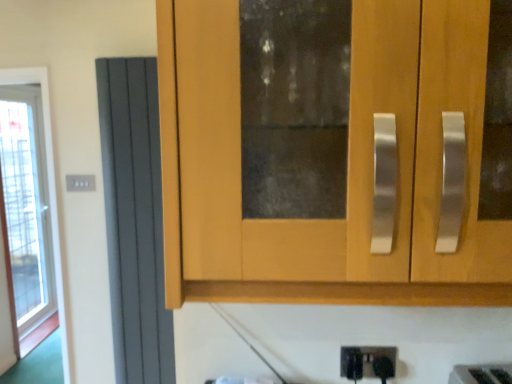
I want to click on white plastic electric outlet at upper left, so click(x=80, y=183).

The image size is (512, 384). Describe the element at coordinates (80, 183) in the screenshot. I see `white plastic electric outlet at upper left` at that location.

Describe the element at coordinates (134, 219) in the screenshot. I see `matte gray radiator at left` at that location.

Locate an element on the screen. matte gray radiator at left is located at coordinates (134, 219).

You are a GUI agent. You are given a task and a screenshot of the screen. Output one action in this format:
    pyautogui.click(x=<x>, y=<y>)
    Task: Click on the white plastic electric outlet at upper left
    The image size is (512, 384).
    Given the screenshot: What is the action you would take?
    pyautogui.click(x=80, y=183)

Between white plastic electric outlet at upper left and matte gray radiator at left, which one appears on the right side from the viewer's perspective?

matte gray radiator at left is more to the right.

Is the position of white plastic electric outlet at upper left less distant than that of matte gray radiator at left?

No, it is not.

Which is behind, point (71, 185) or point (142, 182)?

The point (71, 185) is more distant.

In the scene shown: From the image's perspective, which one is positioned higher, white plastic electric outlet at upper left or matte gray radiator at left?

white plastic electric outlet at upper left, from the image's perspective.

From a real-world perspective, which is physically above, white plastic electric outlet at upper left or matte gray radiator at left?

white plastic electric outlet at upper left, from a real-world perspective.

Is white plastic electric outlet at upper left wider than matte gray radiator at left?

No, white plastic electric outlet at upper left is not wider than matte gray radiator at left.

Between white plastic electric outlet at upper left and matte gray radiator at left, which one has less height?

With less height is white plastic electric outlet at upper left.

Based on the photo, based on their sizes in the image, would you say white plastic electric outlet at upper left is bigger or smaller than matte gray radiator at left?

white plastic electric outlet at upper left is smaller than matte gray radiator at left.

Is white plastic electric outlet at upper left surrounding matte gray radiator at left?

No.

Is white plastic electric outlet at upper left in contact with matte gray radiator at left?

There is a gap between white plastic electric outlet at upper left and matte gray radiator at left.

Is white plastic electric outlet at upper left facing towards matte gray radiator at left?

No, white plastic electric outlet at upper left is not facing towards matte gray radiator at left.

Measure the distance from white plastic electric outlet at upper left to matte gray radiator at left.

The distance of white plastic electric outlet at upper left from matte gray radiator at left is 17.99 inches.

The width and height of the screenshot is (512, 384). I want to click on screen door that is in front of the white plastic electric outlet at upper left, so click(x=134, y=219).

Considering the relative positions of matte gray radiator at left and white plastic electric outlet at upper left in the image provided, is matte gray radiator at left to the right of white plastic electric outlet at upper left from the viewer's perspective?

Correct, you'll find matte gray radiator at left to the right of white plastic electric outlet at upper left.

Which object is closer to the camera, matte gray radiator at left or white plastic electric outlet at upper left?

matte gray radiator at left is more forward.

Considering the points (126, 281) and (86, 184), which point is behind, point (126, 281) or point (86, 184)?

The point (86, 184) is behind.

From the image's perspective, between matte gray radiator at left and white plastic electric outlet at upper left, who is located below?

matte gray radiator at left, from the image's perspective.

Consider the image. From a real-world perspective, is matte gray radiator at left on top of white plastic electric outlet at upper left?

Incorrect, from a real-world perspective, matte gray radiator at left is lower than white plastic electric outlet at upper left.

Considering the relative sizes of matte gray radiator at left and white plastic electric outlet at upper left in the image provided, is matte gray radiator at left wider than white plastic electric outlet at upper left?

Correct, the width of matte gray radiator at left exceeds that of white plastic electric outlet at upper left.

Who is taller, matte gray radiator at left or white plastic electric outlet at upper left?

Standing taller between the two is matte gray radiator at left.

Does matte gray radiator at left have a smaller size compared to white plastic electric outlet at upper left?

No, matte gray radiator at left is not smaller than white plastic electric outlet at upper left.

In the scene shown: Is matte gray radiator at left not inside white plastic electric outlet at upper left?

Yes, matte gray radiator at left is outside of white plastic electric outlet at upper left.

Is matte gray radiator at left in contact with white plastic electric outlet at upper left?

No, matte gray radiator at left is not making contact with white plastic electric outlet at upper left.

Is matte gray radiator at left oriented towards white plastic electric outlet at upper left?

No.

Measure the distance from matte gray radiator at left to white plastic electric outlet at upper left.

matte gray radiator at left is 17.99 inches away from white plastic electric outlet at upper left.

Identify the location of electric outlet located behind the matte gray radiator at left. Image resolution: width=512 pixels, height=384 pixels. (80, 183).

Identify the location of screen door that appears on the right of white plastic electric outlet at upper left. Image resolution: width=512 pixels, height=384 pixels. 134,219.

At what (x,y) coordinates should I click in order to perform the action: click on electric outlet lying behind the matte gray radiator at left. Please return your answer as a coordinate pair (x, y). Looking at the image, I should click on (80, 183).